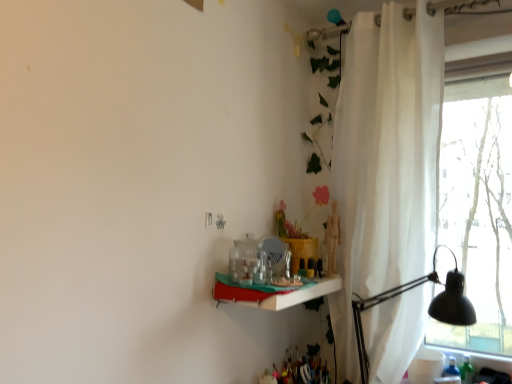
Question: From the image's perspective, is black metal table lamp at right positioned above or below white sheer curtain at right?

Choices:
 (A) below
 (B) above

Answer: (A)

Question: Is point (373, 301) closer or farther from the camera than point (437, 97)?

Choices:
 (A) closer
 (B) farther

Answer: (B)

Question: Which is farther from the white glossy shelf at center?

Choices:
 (A) white sheer curtain at right
 (B) black metal table lamp at right

Answer: (A)

Question: Considering the real-world distances, which object is farthest from the white sheer curtain at right?

Choices:
 (A) black metal table lamp at right
 (B) white glossy shelf at center

Answer: (B)